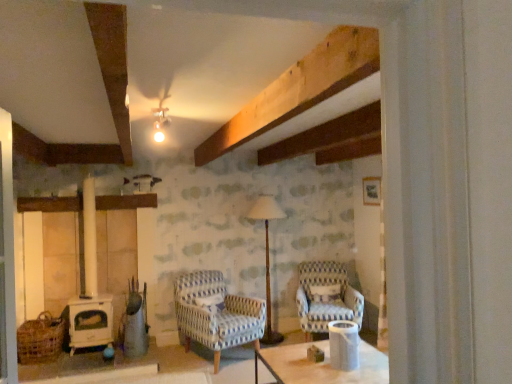
Question: Is blue and white woven fabric armchair at center, which ranks as the 2th chair in right-to-left order, completely or partially outside of woven brown basket at lower left?

Choices:
 (A) yes
 (B) no

Answer: (A)

Question: Is blue and white woven fabric armchair at center, which ranks as the 2th chair in right-to-left order, behind woven brown basket at lower left?

Choices:
 (A) yes
 (B) no

Answer: (A)

Question: From the image's perspective, would you say blue and white woven fabric armchair at center, which ranks as the 2th chair in right-to-left order, is positioned over woven brown basket at lower left?

Choices:
 (A) no
 (B) yes

Answer: (B)

Question: From a real-world perspective, is blue and white woven fabric armchair at center, which ranks as the 2th chair in right-to-left order, positioned over woven brown basket at lower left based on gravity?

Choices:
 (A) no
 (B) yes

Answer: (B)

Question: Does blue and white woven fabric armchair at center, acting as the 1th chair starting from the left, have a lesser height compared to woven brown basket at lower left?

Choices:
 (A) no
 (B) yes

Answer: (A)

Question: Looking at their shapes, would you say blue and white striped fabric armchair at center-right, which appears as the 1th chair when viewed from the right, is wider or thinner than woven brown basket at lower left?

Choices:
 (A) wide
 (B) thin

Answer: (A)

Question: Considering the positions of blue and white striped fabric armchair at center-right, positioned as the 2th chair in left-to-right order, and woven brown basket at lower left in the image, is blue and white striped fabric armchair at center-right, positioned as the 2th chair in left-to-right order, taller or shorter than woven brown basket at lower left?

Choices:
 (A) tall
 (B) short

Answer: (A)

Question: Is point (316, 279) closer or farther from the camera than point (58, 317)?

Choices:
 (A) closer
 (B) farther

Answer: (B)

Question: In the image, is blue and white striped fabric armchair at center-right, which appears as the 1th chair when viewed from the right, positioned in front of or behind woven brown basket at lower left?

Choices:
 (A) behind
 (B) front

Answer: (A)

Question: Is blue and white woven fabric armchair at center, acting as the 1th chair starting from the left, situated inside woven brown basket at lower left or outside?

Choices:
 (A) outside
 (B) inside

Answer: (A)

Question: Considering the positions of blue and white woven fabric armchair at center, which ranks as the 2th chair in right-to-left order, and woven brown basket at lower left in the image, is blue and white woven fabric armchair at center, which ranks as the 2th chair in right-to-left order, bigger or smaller than woven brown basket at lower left?

Choices:
 (A) big
 (B) small

Answer: (A)

Question: Considering their positions, is blue and white woven fabric armchair at center, which ranks as the 2th chair in right-to-left order, located in front of or behind woven brown basket at lower left?

Choices:
 (A) behind
 (B) front

Answer: (A)

Question: From the image's perspective, is blue and white woven fabric armchair at center, which ranks as the 2th chair in right-to-left order, above or below woven brown basket at lower left?

Choices:
 (A) below
 (B) above

Answer: (B)

Question: Relative to woven brown basket at lower left, is white glossy cylindrical container at center in front or behind?

Choices:
 (A) front
 (B) behind

Answer: (A)

Question: Considering the positions of white glossy cylindrical container at center and woven brown basket at lower left in the image, is white glossy cylindrical container at center bigger or smaller than woven brown basket at lower left?

Choices:
 (A) small
 (B) big

Answer: (A)